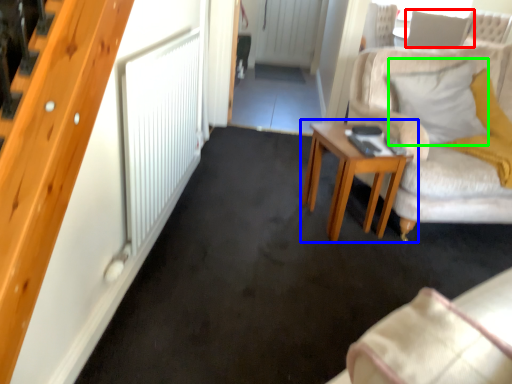
Question: Based on their relative distances, which object is farther from pillow (highlighted by a red box)? Choose from table (highlighted by a blue box) and pillow (highlighted by a green box).

Choices:
 (A) table
 (B) pillow

Answer: (A)